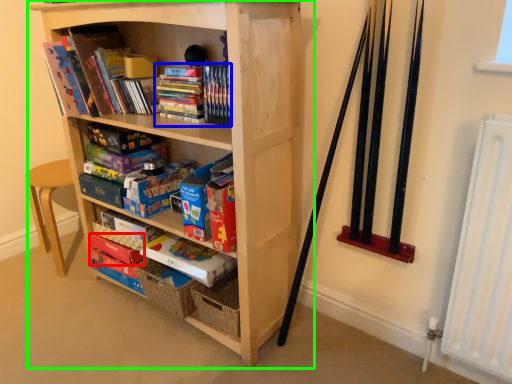
Question: Which is nearer to the paperback book (highlighted by a red box)? book (highlighted by a blue box) or bookcase (highlighted by a green box).

Choices:
 (A) book
 (B) bookcase

Answer: (B)